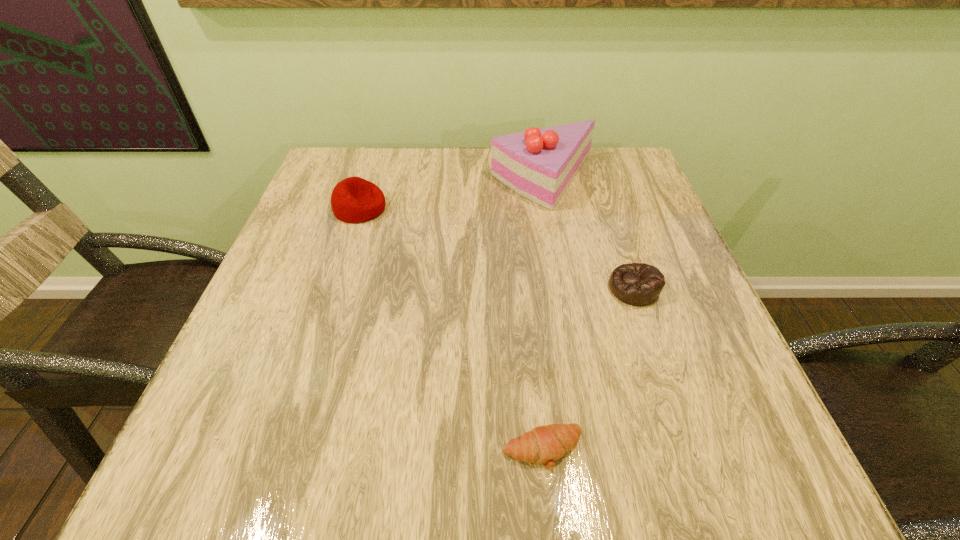
In the image, there is a desktop. Identify the location of vacant space at the near edge. (361, 456).

You are a GUI agent. You are given a task and a screenshot of the screen. Output one action in this format:
    pyautogui.click(x=<x>, y=<y>)
    Task: Click on the free location at the left edge of the desktop
    The width and height of the screenshot is (960, 540).
    Given the screenshot: What is the action you would take?
    pyautogui.click(x=267, y=350)

Identify the location of vacant space at the right edge of the desktop. The height and width of the screenshot is (540, 960). (614, 260).

Identify the location of free point at the far left corner. The image size is (960, 540). (338, 174).

In the image, there is a desktop. Identify the location of free region at the far right corner. (627, 158).

Where is `unoccupied area between the tallest object and the crescent roll`? unoccupied area between the tallest object and the crescent roll is located at coordinates (543, 315).

This screenshot has width=960, height=540. Find the location of `free space between the shortest object and the tallest object`. free space between the shortest object and the tallest object is located at coordinates (543, 315).

At what (x,y) coordinates should I click in order to perform the action: click on free space between the second shortest object and the shortest object. Please return your answer as a coordinate pair (x, y). The height and width of the screenshot is (540, 960). Looking at the image, I should click on (588, 369).

Where is `unoccupied area between the second tallest object and the second shortest object`? unoccupied area between the second tallest object and the second shortest object is located at coordinates (496, 248).

Where is `vacant space that is in between the third farthest object and the tallest object`? vacant space that is in between the third farthest object and the tallest object is located at coordinates (588, 234).